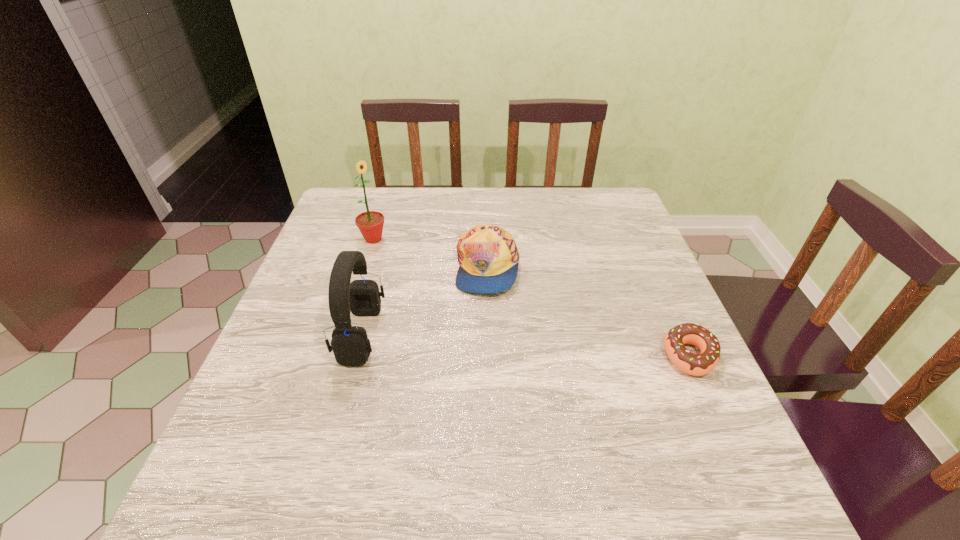
In order to click on vacant space located 0.400m on the face of the tallest object in this screenshot , I will do `click(469, 331)`.

Identify the location of blank space located on the bill of the third tallest object. Image resolution: width=960 pixels, height=540 pixels. (555, 375).

This screenshot has height=540, width=960. Find the location of `blank space located on the bill of the third tallest object`. blank space located on the bill of the third tallest object is located at coordinates (516, 319).

The image size is (960, 540). Identify the location of vacant region located 0.100m on the bill of the third tallest object. (521, 325).

Locate an element on the screen. The image size is (960, 540). headset situated at the left edge is located at coordinates (350, 344).

This screenshot has width=960, height=540. I want to click on sunflower at the left edge, so click(370, 223).

Where is `object present at the right edge`? The image size is (960, 540). object present at the right edge is located at coordinates (701, 364).

This screenshot has width=960, height=540. I want to click on free space at the far edge of the desktop, so click(529, 218).

This screenshot has height=540, width=960. I want to click on free space at the near edge of the desktop, so click(x=432, y=447).

Locate an element on the screen. This screenshot has height=540, width=960. vacant space at the left edge of the desktop is located at coordinates (300, 328).